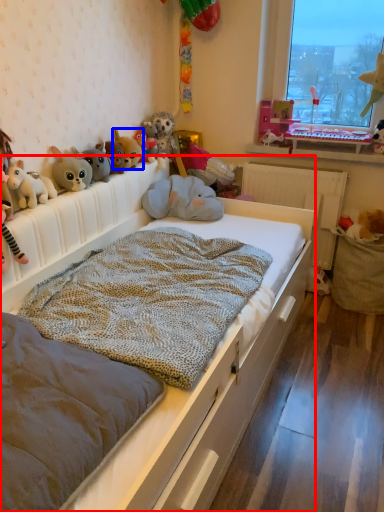
Question: Among these objects, which one is nearest to the camera, bed (highlighted by a red box) or toy (highlighted by a blue box)?

Choices:
 (A) bed
 (B) toy

Answer: (A)